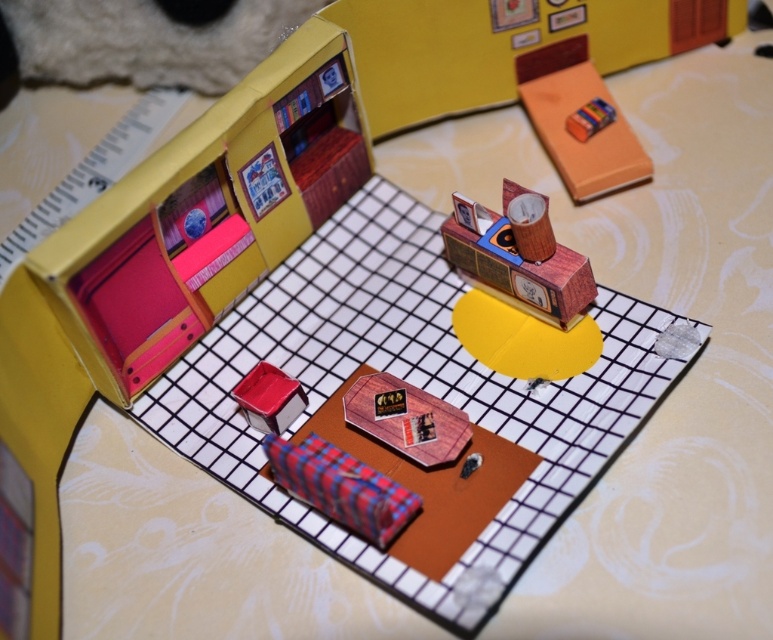
You are designing a layout for a miniature room and need to place both the plaid fabric couch at lower left and the matte red cube at center. Given their sizes, which object will require more space in the room?

The plaid fabric couch at lower left requires more space in the room because it is larger in size than the matte red cube at center.

You are designing a layout for a miniature room and want to place a new shelf between the plaid fabric couch at lower left and the matte red cube at center. Considering their widths, which object requires more horizontal space for the shelf to fit between them?

The plaid fabric couch at lower left requires more horizontal space because its width surpasses that of the matte red cube at center, so the shelf must accommodate its greater width to fit between them.

From the picture: You are a small toy robot that is 10 inches wide. You are currently positioned at the plaid fabric couch at lower left and want to move to the matte red cube at center. Can you fit through the space between them without moving sideways?

The plaid fabric couch at lower left and matte red cube at center are 9.99 inches apart, which is less than your 10 inch width. Therefore, you cannot fit through the space between them without moving sideways.